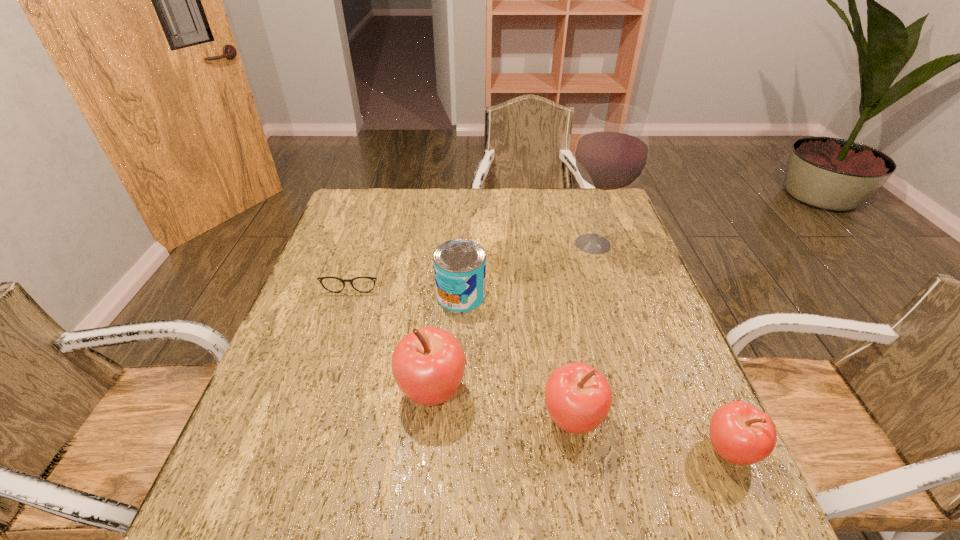
I want to click on free location located on the front of the alcohol, so click(615, 315).

Where is `free space located on the right of the can`? This screenshot has height=540, width=960. free space located on the right of the can is located at coordinates (570, 295).

At what (x,y) coordinates should I click in order to perform the action: click on vacant region located through the lenses of the spectacles. Please return your answer as a coordinate pair (x, y). This screenshot has width=960, height=540. Looking at the image, I should click on (328, 361).

Identify the location of object that is at the far edge. (611, 154).

Identify the location of object that is at the left edge. (332, 284).

I want to click on apple present at the right edge, so click(740, 433).

I want to click on alcohol that is at the right edge, so click(611, 154).

The width and height of the screenshot is (960, 540). What are the coordinates of `object that is positioned at the far right corner` in the screenshot? It's located at tap(611, 154).

Identify the location of object at the near right corner. Image resolution: width=960 pixels, height=540 pixels. (740, 433).

In the image, there is a desktop. Identify the location of vacant space at the far edge. (525, 198).